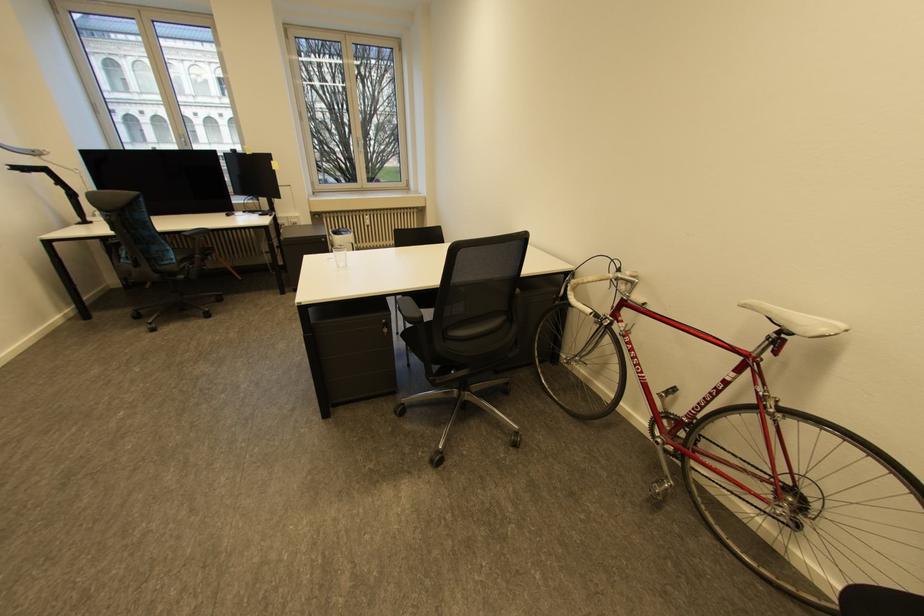
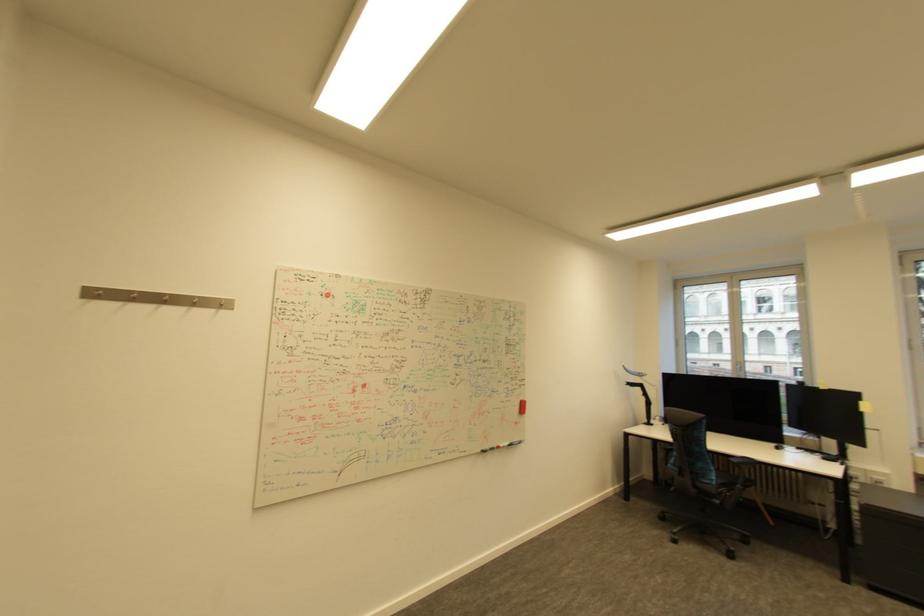
Question: The camera is either moving clockwise (left) or counter-clockwise (right) around the object. The first image is from the beginning of the video and the second image is from the end. Is the camera moving left or right when shooting the video?

Choices:
 (A) Left
 (B) Right

Answer: (B)